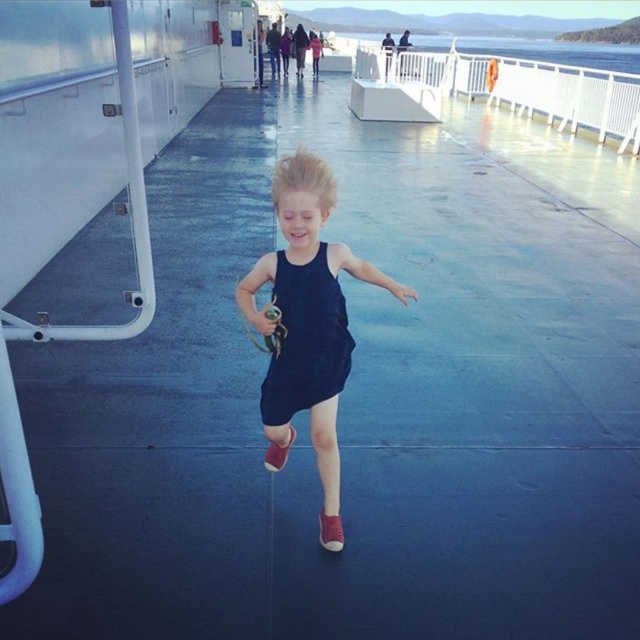
Question: Which object appears farthest from the camera in this image?

Choices:
 (A) navy matte dress at center
 (B) matte red shoe at center
 (C) black matte dress at center
 (D) suede-like brown shoe at center

Answer: (B)

Question: Can you confirm if black matte dress at center is smaller than matte red shoe at center?

Choices:
 (A) yes
 (B) no

Answer: (B)

Question: Which point appears farthest from the camera in this image?

Choices:
 (A) tap(317, 531)
 (B) tap(275, 304)
 (C) tap(292, 436)

Answer: (C)

Question: Which of the following is the farthest from the observer?

Choices:
 (A) matte red shoe at center
 (B) suede-like brown shoe at center

Answer: (A)

Question: Is black matte dress at center to the left of matte red shoe at center from the viewer's perspective?

Choices:
 (A) yes
 (B) no

Answer: (B)

Question: Can you confirm if black matte dress at center is thinner than matte red shoe at center?

Choices:
 (A) no
 (B) yes

Answer: (A)